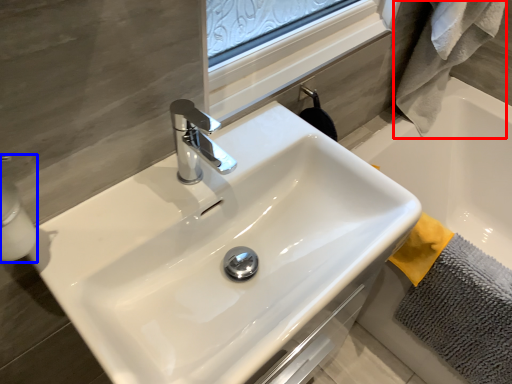
Question: Which object appears farthest to the camera in this image, bath towel (highlighted by a red box) or soap dispenser (highlighted by a blue box)?

Choices:
 (A) bath towel
 (B) soap dispenser

Answer: (A)